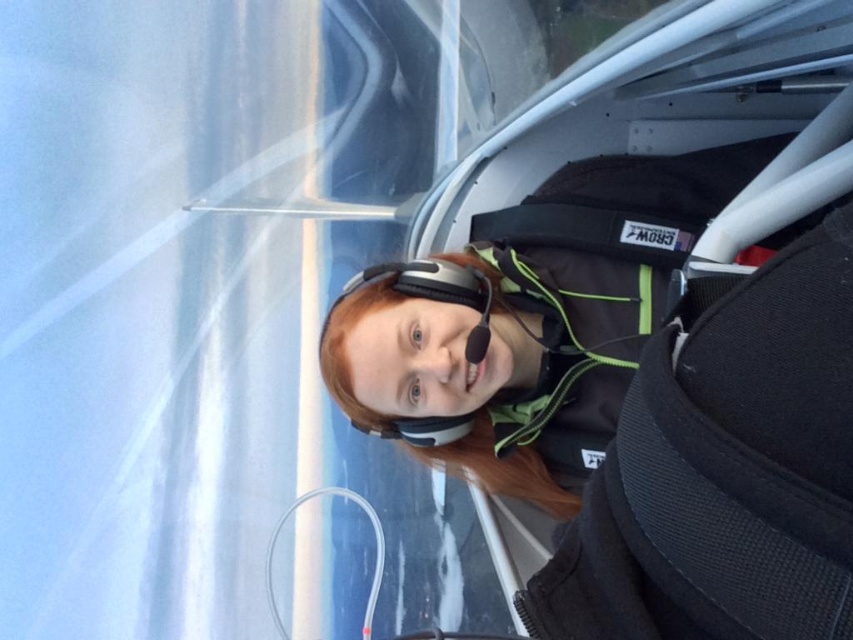
Between point (401, 280) and point (476, 269), which one is positioned in front?

Point (401, 280) is in front.

Image resolution: width=853 pixels, height=640 pixels. What do you see at coordinates (434, 291) in the screenshot?
I see `transparent plastic goggles at center` at bounding box center [434, 291].

You are a GUI agent. You are given a task and a screenshot of the screen. Output one action in this format:
    pyautogui.click(x=<x>, y=<y>)
    Task: Click on the transparent plastic goggles at center
    The height and width of the screenshot is (640, 853).
    Given the screenshot: What is the action you would take?
    pyautogui.click(x=434, y=291)

Can you confirm if black fabric strap at center is positioned to the left of matte black earphone at center?

Incorrect, black fabric strap at center is not on the left side of matte black earphone at center.

Image resolution: width=853 pixels, height=640 pixels. Find the location of `black fabric strap at center`. black fabric strap at center is located at coordinates (572, 342).

Does black fabric strap at center have a lesser height compared to transparent plastic goggles at center?

In fact, black fabric strap at center may be taller than transparent plastic goggles at center.

Between black fabric strap at center and transparent plastic goggles at center, which one has less height?

With less height is transparent plastic goggles at center.

Does point (627, 269) lie behind point (465, 269)?

No, (627, 269) is in front of (465, 269).

The width and height of the screenshot is (853, 640). What are the coordinates of `black fabric strap at center` in the screenshot? It's located at (572, 342).